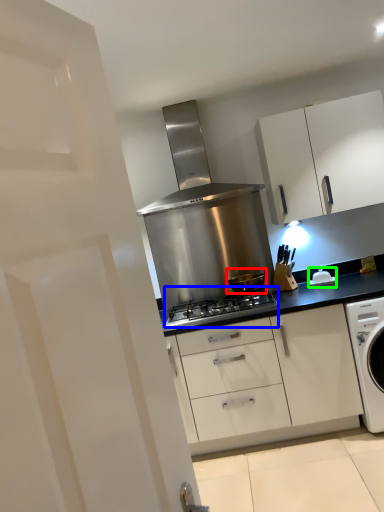
Question: Based on their relative distances, which object is farther from kitchen appliance (highlighted by a red box)? Choose from gas stove (highlighted by a blue box) and appliance (highlighted by a green box).

Choices:
 (A) gas stove
 (B) appliance

Answer: (B)